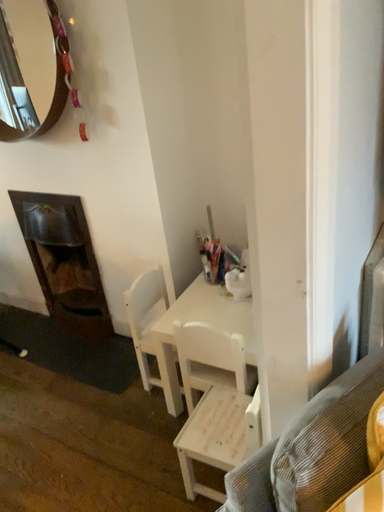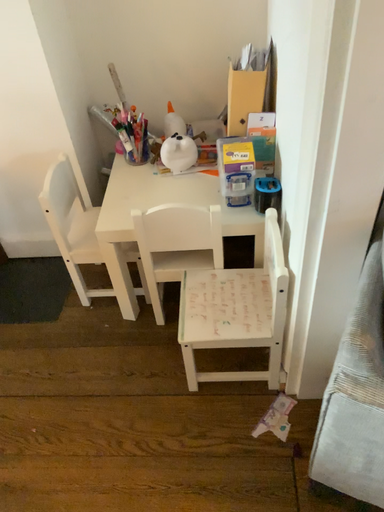
Question: Which way did the camera rotate in the video?

Choices:
 (A) rotated right
 (B) rotated left

Answer: (A)